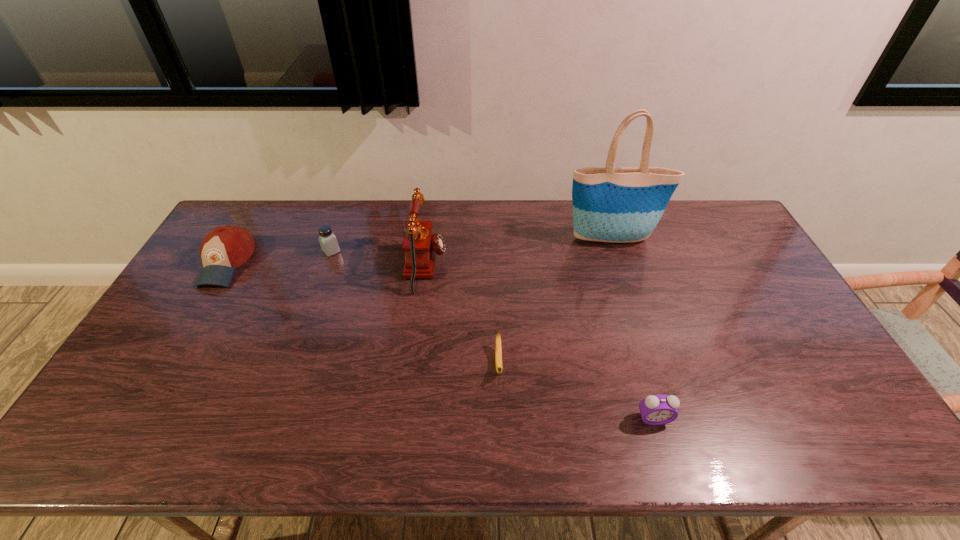
I want to click on tote bag, so click(x=611, y=204).

This screenshot has width=960, height=540. Find the location of `the fourth object from right to left`. the fourth object from right to left is located at coordinates (420, 245).

Locate an element on the screen. This screenshot has width=960, height=540. the second tallest object is located at coordinates (420, 245).

This screenshot has height=540, width=960. Identify the location of the leftmost object. (225, 248).

Identify the location of the second object from left to right. This screenshot has width=960, height=540. (328, 242).

I want to click on alarm clock, so click(660, 409).

Find the location of a particular element. The width and height of the screenshot is (960, 540). banana is located at coordinates (498, 349).

Locate an element on the screen. This screenshot has height=540, width=960. the shortest object is located at coordinates (498, 349).

The height and width of the screenshot is (540, 960). Find the location of `free space located on the left of the tallest object`. free space located on the left of the tallest object is located at coordinates (543, 240).

This screenshot has width=960, height=540. I want to click on free space located on the dial of the second tallest object, so click(559, 267).